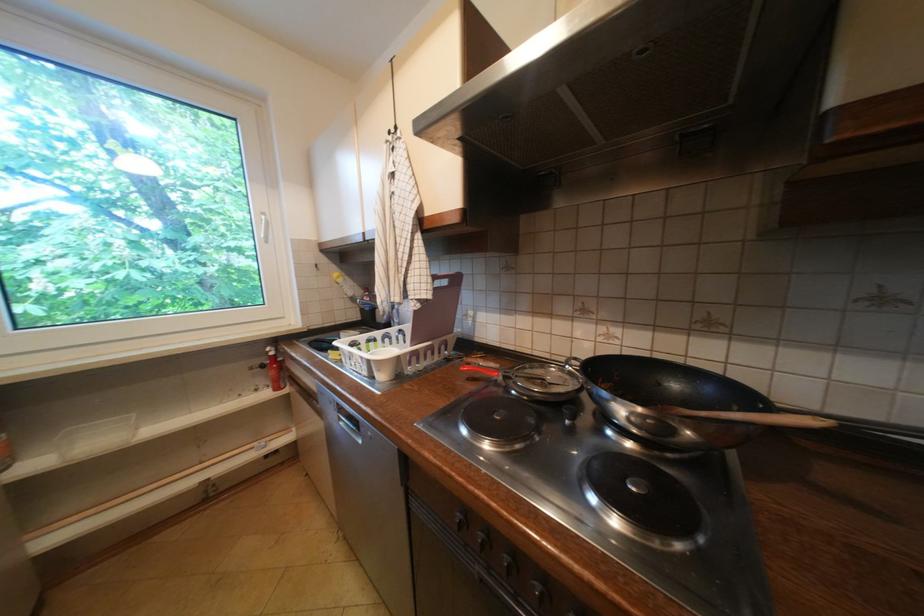
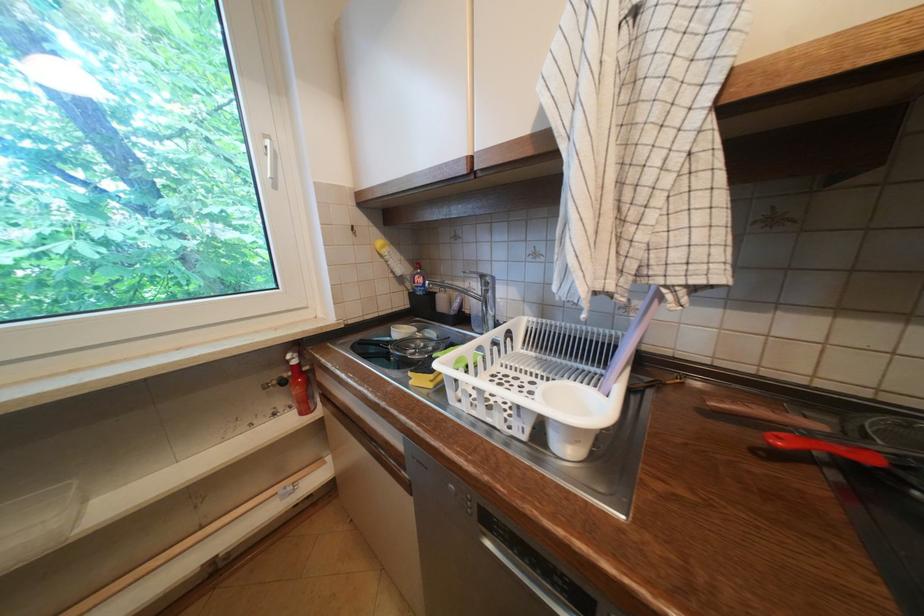
Locate, in the second image, the point that corresponds to point (472, 369) in the first image.

(788, 440)